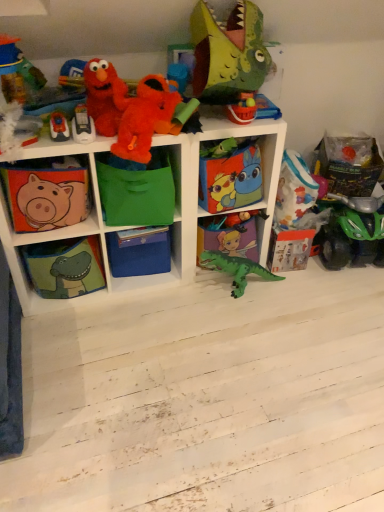
Where is `free space between green fabric storage cubes at center, which is counted as the 3th shelf, starting from the right, and green plastic dinosaur at center, which ranks as the 1th toy in bottom-to-top order`? free space between green fabric storage cubes at center, which is counted as the 3th shelf, starting from the right, and green plastic dinosaur at center, which ranks as the 1th toy in bottom-to-top order is located at coordinates (147, 300).